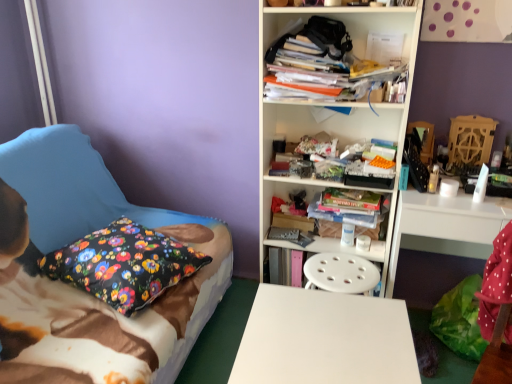
Question: Can you confirm if white smooth desk at center is bigger than white plastic bookcase at center?

Choices:
 (A) no
 (B) yes

Answer: (A)

Question: Is white smooth desk at center positioned behind white plastic bookcase at center?

Choices:
 (A) yes
 (B) no

Answer: (B)

Question: Could you tell me if white smooth desk at center is turned towards white plastic bookcase at center?

Choices:
 (A) no
 (B) yes

Answer: (A)

Question: Does white smooth desk at center have a lesser height compared to white plastic bookcase at center?

Choices:
 (A) yes
 (B) no

Answer: (A)

Question: Is white smooth desk at center directly adjacent to white plastic bookcase at center?

Choices:
 (A) yes
 (B) no

Answer: (B)

Question: From the image's perspective, is floral fabric pillow at left located above or below white plastic bookcase at center?

Choices:
 (A) above
 (B) below

Answer: (B)

Question: Is floral fabric pillow at left inside or outside of white plastic bookcase at center?

Choices:
 (A) inside
 (B) outside

Answer: (B)

Question: Is floral fabric pillow at left to the left or to the right of white plastic bookcase at center in the image?

Choices:
 (A) right
 (B) left

Answer: (B)

Question: Looking at the image, does floral fabric pillow at left seem bigger or smaller compared to white plastic bookcase at center?

Choices:
 (A) big
 (B) small

Answer: (A)

Question: Do you think white plastic bookcase at center is within white glossy computer desk at right, or outside of it?

Choices:
 (A) outside
 (B) inside

Answer: (A)

Question: Does point (382, 16) appear closer or farther from the camera than point (466, 254)?

Choices:
 (A) farther
 (B) closer

Answer: (B)

Question: From a real-world perspective, relative to white glossy computer desk at right, is white plastic bookcase at center vertically above or below?

Choices:
 (A) above
 (B) below

Answer: (A)

Question: Considering the positions of white plastic bookcase at center and white glossy computer desk at right in the image, is white plastic bookcase at center taller or shorter than white glossy computer desk at right?

Choices:
 (A) tall
 (B) short

Answer: (A)

Question: Looking at their shapes, would you say floral fabric pillow at left is wider or thinner than white glossy computer desk at right?

Choices:
 (A) thin
 (B) wide

Answer: (B)

Question: In the image, is floral fabric pillow at left positioned in front of or behind white glossy computer desk at right?

Choices:
 (A) behind
 (B) front

Answer: (B)